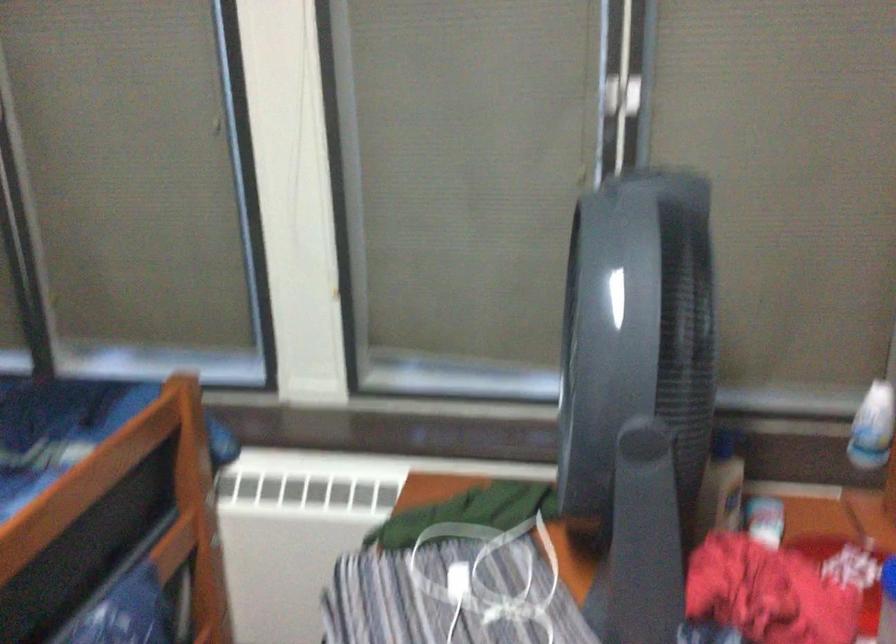
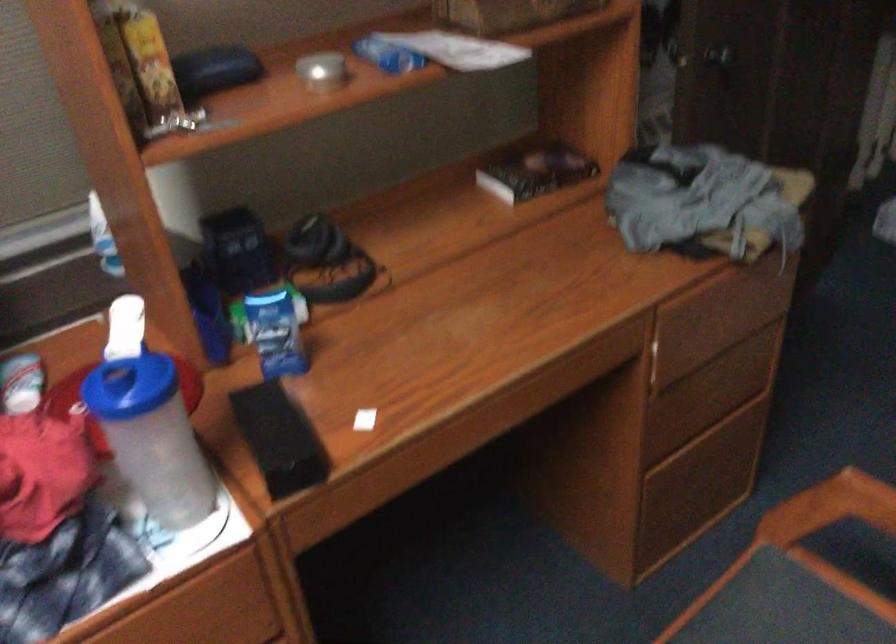
How did the camera likely rotate?

The rotation direction of the camera is right-down.